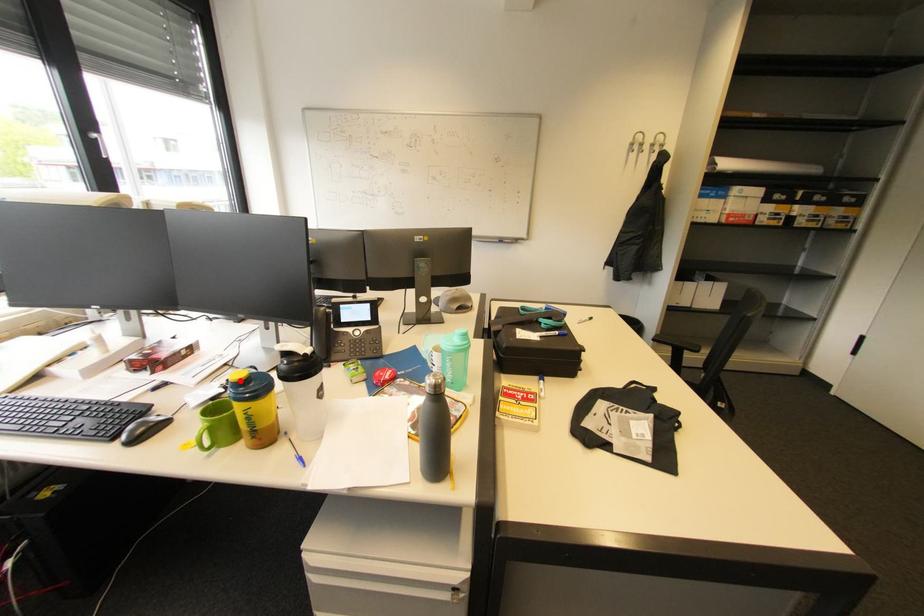
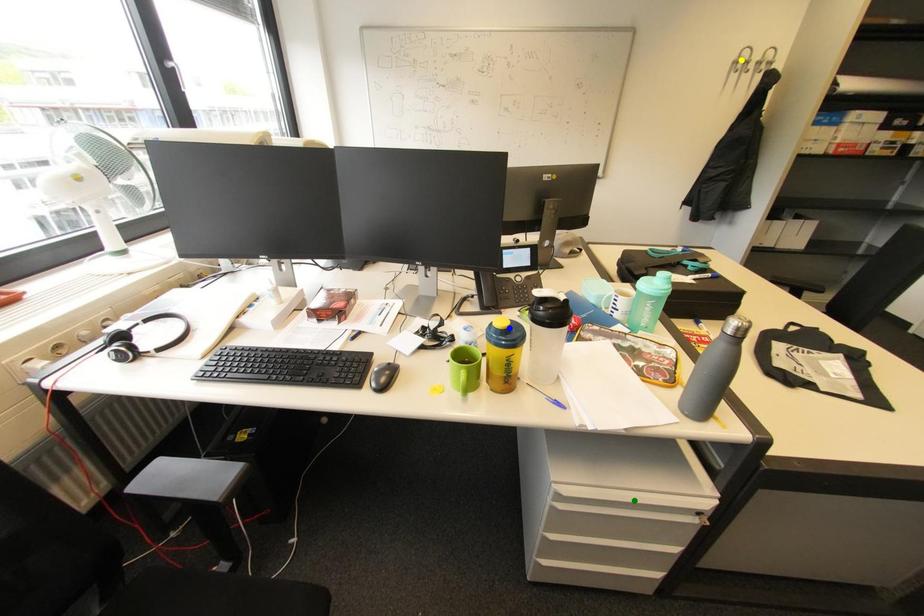
Question: I am providing you with two images of the same scene from different viewpoints. A red point is marked on the first image. You are given multiple points on the second image. In image 2, which mark is for the same physical point as the one in image 1?

Choices:
 (A) yellow point
 (B) green point
 (C) blue point

Answer: (C)